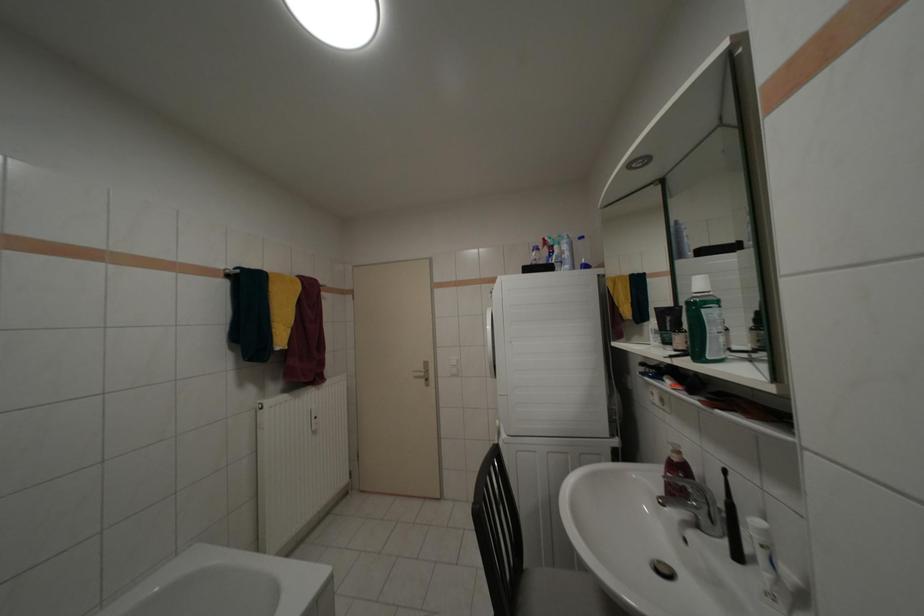
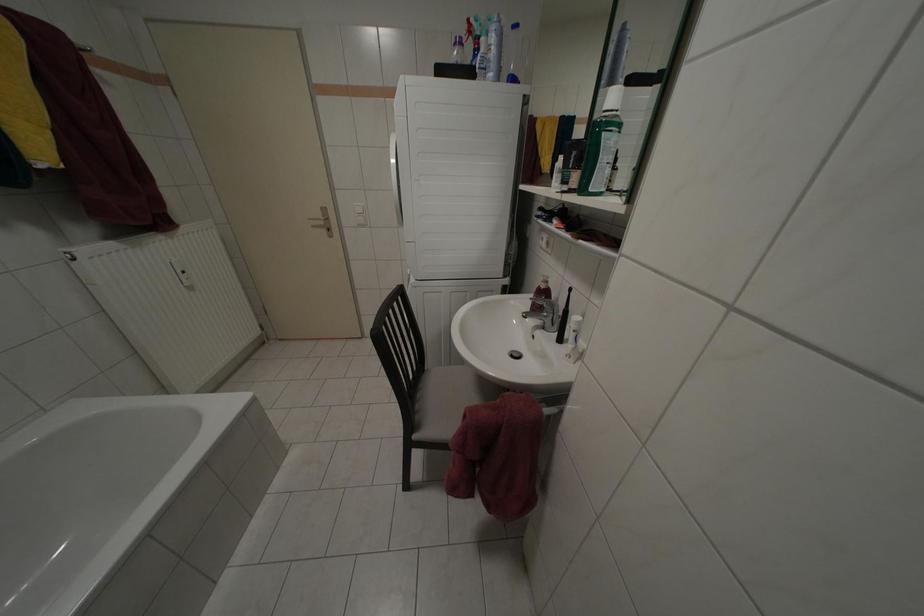
The images are taken continuously from a first-person perspective. In which direction is your viewpoint rotating?

The rotation direction of the camera is right-down.